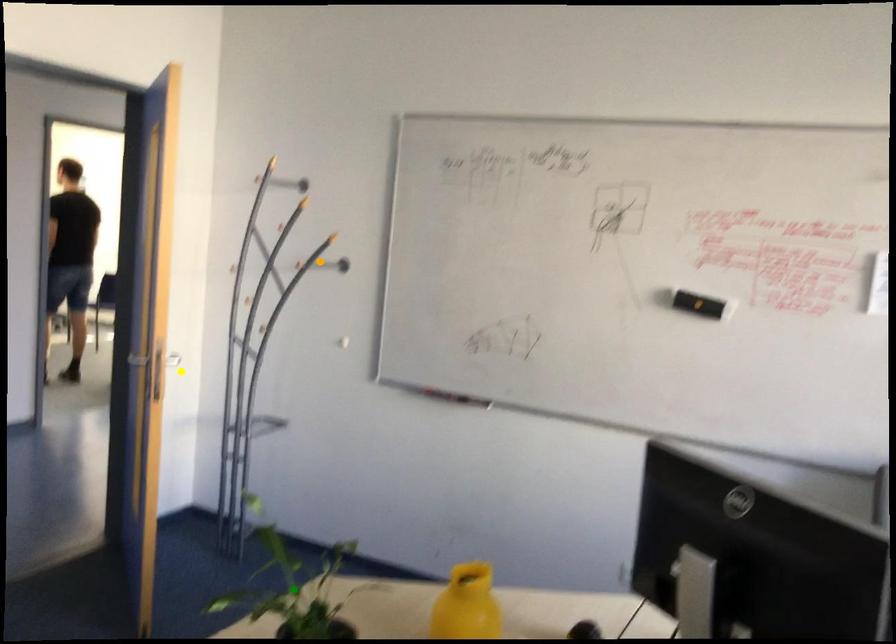
Order these from farthest to nearest:
1. orange point
2. yellow point
3. green point

yellow point, orange point, green point